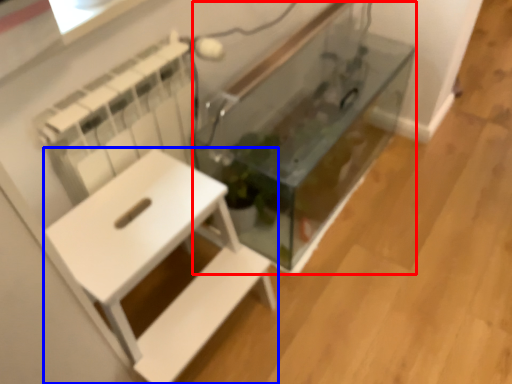
Question: Among these objects, which one is nearest to the camera, glass box (highlighted by a red box) or furniture (highlighted by a blue box)?

Choices:
 (A) glass box
 (B) furniture

Answer: (B)